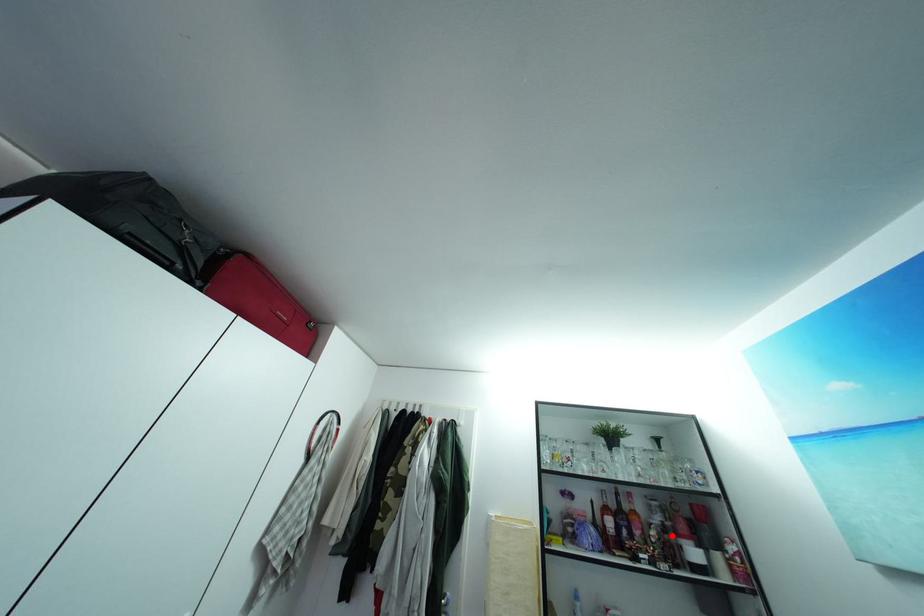
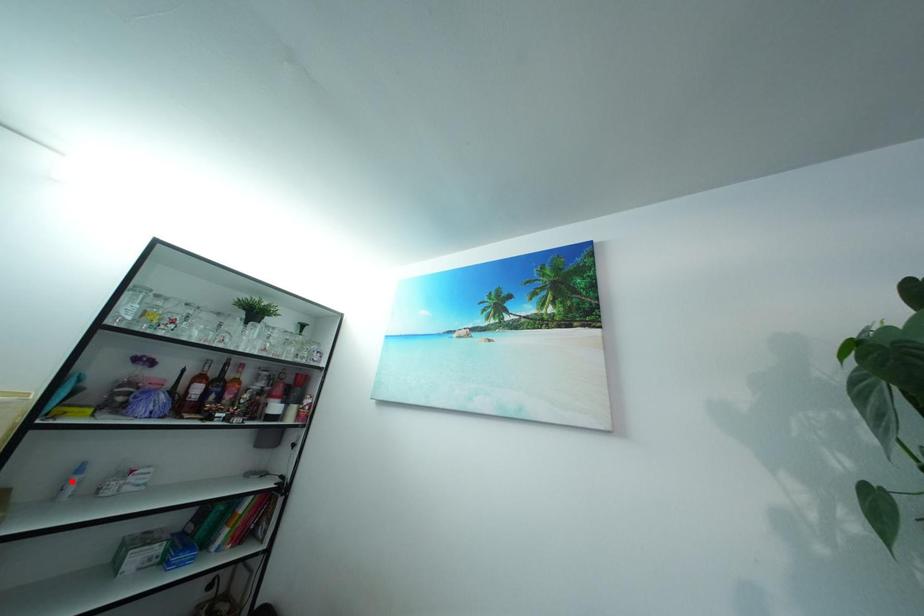
I am providing you with two images of the same scene from different viewpoints. A red point is marked on the first image and another point is marked on the second image. Does the point marked in image1 correspond to the same location as the one in image2?

No